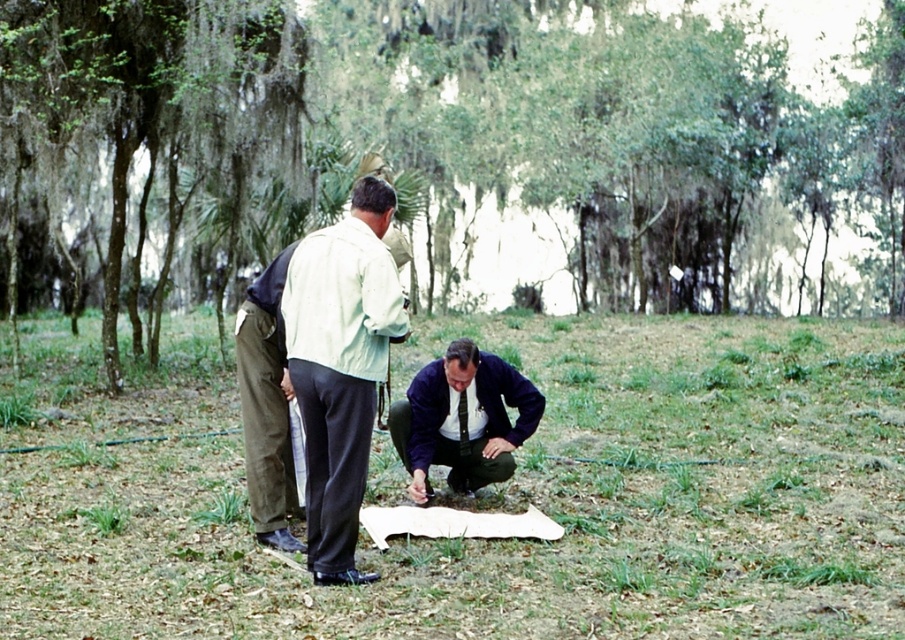
Question: Is green grass at center smaller than khaki cotton pants at center?

Choices:
 (A) yes
 (B) no

Answer: (B)

Question: Which of the following is the farthest from the observer?

Choices:
 (A) (591, 115)
 (B) (675, 314)
 (C) (345, 576)
 (D) (287, 388)

Answer: (A)

Question: Is light beige fabric shirt at center wider than dark blue fabric at lower center?

Choices:
 (A) yes
 (B) no

Answer: (B)

Question: Which object appears closest to the camera in this image?

Choices:
 (A) light beige fabric shirt at center
 (B) green mossy tree at center
 (C) khaki cotton pants at center

Answer: (A)

Question: Is the position of light beige fabric shirt at center more distant than that of khaki cotton pants at center?

Choices:
 (A) yes
 (B) no

Answer: (B)

Question: Which of these objects is positioned farthest from the green mossy tree at center?

Choices:
 (A) khaki cotton pants at center
 (B) dark blue fabric at lower center

Answer: (A)